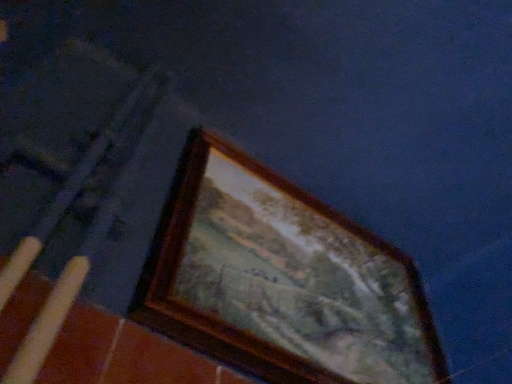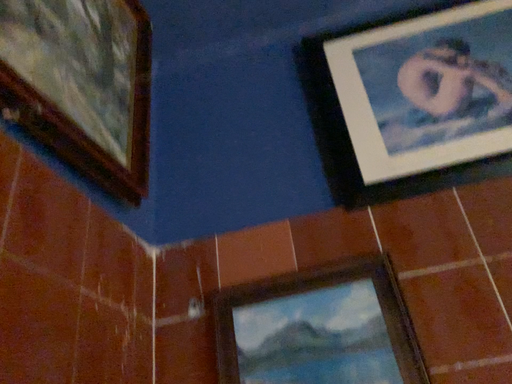
Question: Which way did the camera rotate in the video?

Choices:
 (A) rotated upward
 (B) rotated downward

Answer: (B)